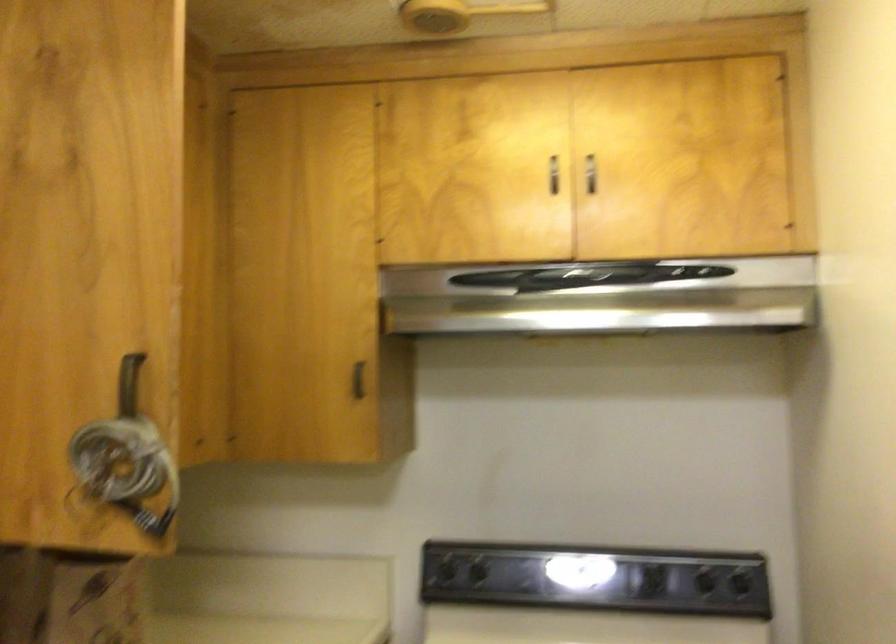
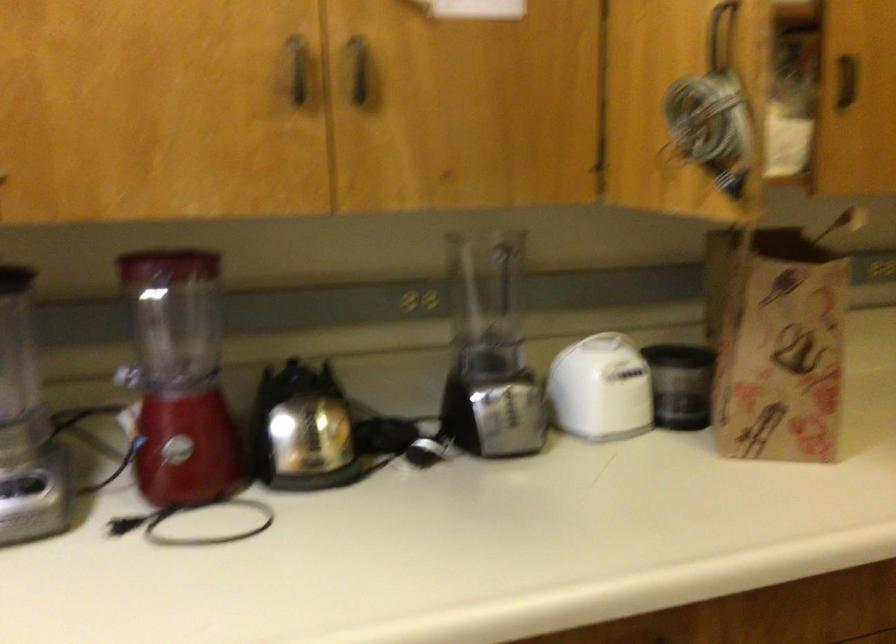
Question: How did the camera likely rotate?

Choices:
 (A) Left
 (B) Right
 (C) Up
 (D) Down

Answer: (A)